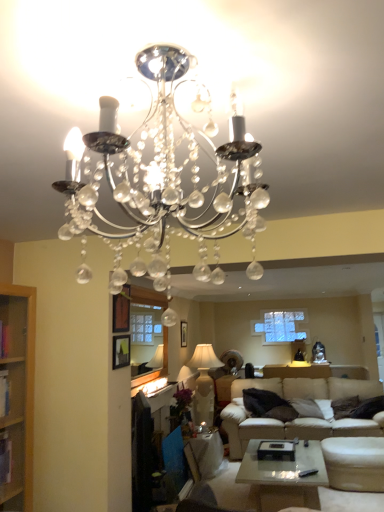
What do you see at coordinates (166, 169) in the screenshot? This screenshot has width=384, height=512. I see `clear crystal chandelier at upper center, positioned as the second lamp in back-to-front order` at bounding box center [166, 169].

Find the location of a particular element. This screenshot has width=384, height=512. white fabric lampshade at center, positioned as the 1th lamp in bottom-to-top order is located at coordinates (204, 383).

Is matte white side table at lower center spatially inside clear crystal chandelier at upper center, positioned as the second lamp in back-to-front order, or outside of it?

matte white side table at lower center exists outside the volume of clear crystal chandelier at upper center, positioned as the second lamp in back-to-front order.

From the picture: Considering their positions, is matte white side table at lower center located in front of or behind clear crystal chandelier at upper center, acting as the first lamp starting from the top?

Clearly, matte white side table at lower center is behind clear crystal chandelier at upper center, acting as the first lamp starting from the top.

Could you tell me if matte white side table at lower center is turned towards clear crystal chandelier at upper center, acting as the first lamp starting from the top?

No.

Looking at this image, looking at the image, does matte white side table at lower center seem bigger or smaller compared to clear crystal chandelier at upper center, the second lamp from the bottom?

matte white side table at lower center is bigger than clear crystal chandelier at upper center, the second lamp from the bottom.

Is white fabric lampshade at center, arranged as the 2th lamp when viewed from the top, facing away from matte white side table at lower center?

That's not correct — white fabric lampshade at center, arranged as the 2th lamp when viewed from the top, is not looking away from matte white side table at lower center.

The width and height of the screenshot is (384, 512). In order to click on the 1st lamp above when counting from the matte white side table at lower center (from the image's perspective) in this screenshot , I will do pyautogui.click(x=204, y=383).

Is white fabric lampshade at center, positioned as the 1th lamp in bottom-to-top order, not within matte white side table at lower center?

Indeed, white fabric lampshade at center, positioned as the 1th lamp in bottom-to-top order, is completely outside matte white side table at lower center.

Which object is closer to the camera, beige fabric couch at lower right or white fabric lampshade at center, positioned as the 1th lamp in bottom-to-top order?

beige fabric couch at lower right is closer to the camera.

Between beige fabric couch at lower right and white fabric lampshade at center, which is counted as the second lamp, starting from the front, which one has smaller size?

With smaller size is white fabric lampshade at center, which is counted as the second lamp, starting from the front.

Looking at this image, how different are the orientations of beige fabric couch at lower right and white fabric lampshade at center, marked as the 1th lamp in a back-to-front arrangement, in degrees?

There is a 88.5-degree angle between the facing directions of beige fabric couch at lower right and white fabric lampshade at center, marked as the 1th lamp in a back-to-front arrangement.

Looking at this image, can you confirm if beige fabric couch at lower right is taller than white fabric lampshade at center, arranged as the 2th lamp when viewed from the top?

In fact, beige fabric couch at lower right may be shorter than white fabric lampshade at center, arranged as the 2th lamp when viewed from the top.

How different are the orientations of clear crystal chandelier at upper center, the second lamp from the bottom, and clear glass window screen at center in degrees?

clear crystal chandelier at upper center, the second lamp from the bottom, and clear glass window screen at center are facing 0.656 degrees away from each other.

Which is in front, point (247, 187) or point (137, 288)?

The point (247, 187) is closer to the camera.

Does clear crystal chandelier at upper center, the second lamp from the bottom, turn towards clear glass window screen at center?

No, clear crystal chandelier at upper center, the second lamp from the bottom, is not turned towards clear glass window screen at center.

From a real-world perspective, is clear glass window screen at center under white fabric lampshade at center, marked as the 1th lamp in a back-to-front arrangement?

No.

Does clear glass window screen at center appear on the left side of white fabric lampshade at center, which is counted as the second lamp, starting from the front?

Correct, you'll find clear glass window screen at center to the left of white fabric lampshade at center, which is counted as the second lamp, starting from the front.

Is clear glass window screen at center in front of or behind white fabric lampshade at center, positioned as the 1th lamp in bottom-to-top order, in the image?

In the image, clear glass window screen at center appears in front of white fabric lampshade at center, positioned as the 1th lamp in bottom-to-top order.

Considering the relative sizes of white fabric lampshade at center, marked as the 1th lamp in a back-to-front arrangement, and clear crystal chandelier at upper center, positioned as the second lamp in back-to-front order, in the image provided, is white fabric lampshade at center, marked as the 1th lamp in a back-to-front arrangement, bigger than clear crystal chandelier at upper center, positioned as the second lamp in back-to-front order,?

Answer: Correct, white fabric lampshade at center, marked as the 1th lamp in a back-to-front arrangement, is larger in size than clear crystal chandelier at upper center, positioned as the second lamp in back-to-front order.

Is clear crystal chandelier at upper center, positioned as the first lamp in front-to-back order, surrounded by white fabric lampshade at center, which is counted as the second lamp, starting from the front?

No.

Considering the relative sizes of white fabric lampshade at center, which is counted as the second lamp, starting from the front, and clear crystal chandelier at upper center, acting as the first lamp starting from the top, in the image provided, is white fabric lampshade at center, which is counted as the second lamp, starting from the front, shorter than clear crystal chandelier at upper center, acting as the first lamp starting from the top,?

In fact, white fabric lampshade at center, which is counted as the second lamp, starting from the front, may be taller than clear crystal chandelier at upper center, acting as the first lamp starting from the top.

Is point (134, 300) closer to camera compared to point (159, 59)?

No, (134, 300) is further to viewer.

Which of these two, clear glass window screen at center or clear crystal chandelier at upper center, acting as the first lamp starting from the top, stands shorter?

With less height is clear crystal chandelier at upper center, acting as the first lamp starting from the top.

Considering the relative positions of clear glass window screen at center and clear crystal chandelier at upper center, acting as the first lamp starting from the top, in the image provided, is clear glass window screen at center in front of clear crystal chandelier at upper center, acting as the first lamp starting from the top,?

No, it is not.

Based on the photo, from the image's perspective, between clear glass window screen at center and clear crystal chandelier at upper center, acting as the first lamp starting from the top, who is located below?

clear glass window screen at center, from the image's perspective.

Identify the location of side table on the right of clear crystal chandelier at upper center, the second lamp from the bottom. This screenshot has height=512, width=384. (204, 455).

Identify the location of the 1st lamp above the matte white side table at lower center (from the image's perspective). (204, 383).

Looking at the image, which one is located further to clear glass window screen at center, clear crystal chandelier at upper center, positioned as the second lamp in back-to-front order, or white fabric lampshade at center, marked as the 1th lamp in a back-to-front arrangement?

clear crystal chandelier at upper center, positioned as the second lamp in back-to-front order, lies further to clear glass window screen at center than the other object.

Which object lies further to the anchor point clear crystal chandelier at upper center, positioned as the first lamp in front-to-back order, beige fabric couch at lower right or white fabric lampshade at center, arranged as the 2th lamp when viewed from the top?

white fabric lampshade at center, arranged as the 2th lamp when viewed from the top, lies further to clear crystal chandelier at upper center, positioned as the first lamp in front-to-back order, than the other object.

Which object lies nearer to the anchor point matte white side table at lower center, clear crystal chandelier at upper center, acting as the first lamp starting from the top, or clear glass window screen at center?

clear glass window screen at center is positioned closer to the anchor matte white side table at lower center.

Estimate the real-world distances between objects in this image. Which object is closer to matte white side table at lower center, beige fabric couch at lower right or clear crystal chandelier at upper center, the second lamp from the bottom?

beige fabric couch at lower right lies closer to matte white side table at lower center than the other object.

Based on their spatial positions, is clear crystal chandelier at upper center, the second lamp from the bottom, or matte white side table at lower center closer to clear glass window screen at center?

matte white side table at lower center lies closer to clear glass window screen at center than the other object.

Which object lies further to the anchor point clear glass window screen at center, matte white side table at lower center or white fabric lampshade at center, which is counted as the second lamp, starting from the front?

white fabric lampshade at center, which is counted as the second lamp, starting from the front.

Looking at the image, which one is located further to beige fabric couch at lower right, white fabric lampshade at center, arranged as the 2th lamp when viewed from the top, or matte white side table at lower center?

white fabric lampshade at center, arranged as the 2th lamp when viewed from the top.

From the image, which object appears to be farther from beige fabric couch at lower right, white fabric lampshade at center, positioned as the 1th lamp in bottom-to-top order, or clear glass window screen at center?

clear glass window screen at center is further to beige fabric couch at lower right.

Find the location of `side table between clear glass window screen at center and white fabric lampshade at center, which is counted as the second lamp, starting from the front, from front to back`. side table between clear glass window screen at center and white fabric lampshade at center, which is counted as the second lamp, starting from the front, from front to back is located at coordinates coord(204,455).

Where is `side table located between clear glass window screen at center and beige fabric couch at lower right in the left-right direction`? Image resolution: width=384 pixels, height=512 pixels. side table located between clear glass window screen at center and beige fabric couch at lower right in the left-right direction is located at coordinates (x=204, y=455).

Identify the location of window screen between clear crystal chandelier at upper center, positioned as the first lamp in front-to-back order, and white fabric lampshade at center, which is counted as the second lamp, starting from the front, along the z-axis. (147, 297).

The image size is (384, 512). In order to click on side table positioned between clear crystal chandelier at upper center, the second lamp from the bottom, and beige fabric couch at lower right from near to far in this screenshot , I will do click(204, 455).